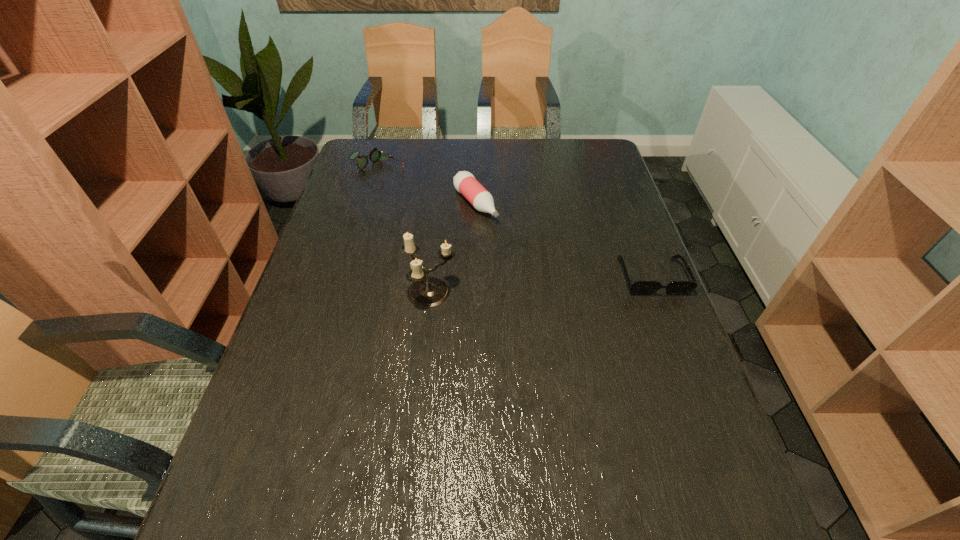
Where is `free spot on the desktop that is between the candle holder and the rightmost object and is positioned with the cap open on the second farthest object`? This screenshot has height=540, width=960. free spot on the desktop that is between the candle holder and the rightmost object and is positioned with the cap open on the second farthest object is located at coordinates (551, 284).

Locate an element on the screen. This screenshot has width=960, height=540. vacant spot on the desktop that is between the candle holder and the rightmost object and is positioned on the front-facing side of the spectacles is located at coordinates (569, 283).